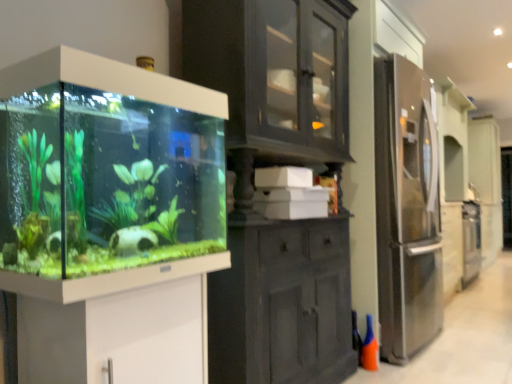
Question: Is the surface of orange matte cone at lower right in direct contact with transparent glass aquarium at left?

Choices:
 (A) no
 (B) yes

Answer: (A)

Question: From a real-world perspective, is orange matte cone at lower right beneath transparent glass aquarium at left?

Choices:
 (A) no
 (B) yes

Answer: (B)

Question: Is orange matte cone at lower right facing towards transparent glass aquarium at left?

Choices:
 (A) no
 (B) yes

Answer: (A)

Question: Does orange matte cone at lower right have a smaller size compared to transparent glass aquarium at left?

Choices:
 (A) yes
 (B) no

Answer: (A)

Question: Is orange matte cone at lower right located outside transparent glass aquarium at left?

Choices:
 (A) no
 (B) yes

Answer: (B)

Question: From a real-world perspective, is white glossy vanity at lower left positioned above or below transparent glass aquarium at left?

Choices:
 (A) above
 (B) below

Answer: (B)

Question: Looking at the image, does white glossy vanity at lower left seem bigger or smaller compared to transparent glass aquarium at left?

Choices:
 (A) small
 (B) big

Answer: (A)

Question: Is white glossy vanity at lower left situated inside transparent glass aquarium at left or outside?

Choices:
 (A) outside
 (B) inside

Answer: (A)

Question: Is point (143, 331) closer or farther from the camera than point (153, 261)?

Choices:
 (A) closer
 (B) farther

Answer: (B)

Question: Considering the positions of transparent glass aquarium at left and white glossy vanity at lower left in the image, is transparent glass aquarium at left bigger or smaller than white glossy vanity at lower left?

Choices:
 (A) small
 (B) big

Answer: (B)

Question: Looking at their shapes, would you say transparent glass aquarium at left is wider or thinner than white glossy vanity at lower left?

Choices:
 (A) thin
 (B) wide

Answer: (A)

Question: Considering their positions, is transparent glass aquarium at left located in front of or behind white glossy vanity at lower left?

Choices:
 (A) front
 (B) behind

Answer: (A)

Question: Considering the positions of point (144, 170) and point (99, 309), is point (144, 170) closer or farther from the camera than point (99, 309)?

Choices:
 (A) closer
 (B) farther

Answer: (B)

Question: Considering the positions of orange matte cone at lower right and transparent glass aquarium at left in the image, is orange matte cone at lower right bigger or smaller than transparent glass aquarium at left?

Choices:
 (A) small
 (B) big

Answer: (A)

Question: Considering the positions of point (368, 332) and point (101, 254), is point (368, 332) closer or farther from the camera than point (101, 254)?

Choices:
 (A) closer
 (B) farther

Answer: (B)